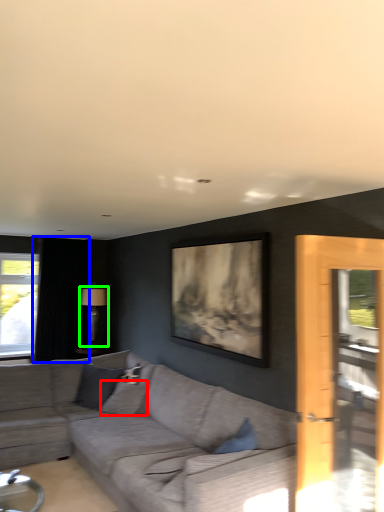
Question: Based on their relative distances, which object is nearer to pillow (highlighted by a red box)? Choose from curtain (highlighted by a blue box) and lamp (highlighted by a green box).

Choices:
 (A) curtain
 (B) lamp

Answer: (B)